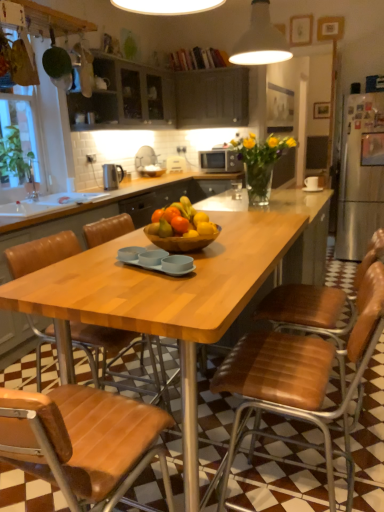
Question: Does matte dark wood cabinets at upper center, the first cabinetry viewed from the right, come behind brown leather chair at lower left, placed as the first chair when sorted from left to right?

Choices:
 (A) no
 (B) yes

Answer: (B)

Question: Can you confirm if matte dark wood cabinets at upper center, the first cabinetry viewed from the right, is smaller than brown leather chair at lower left, placed as the first chair when sorted from left to right?

Choices:
 (A) yes
 (B) no

Answer: (B)

Question: Is matte dark wood cabinets at upper center, marked as the 2th cabinetry in a left-to-right arrangement, oriented away from brown leather chair at lower left, placed as the first chair when sorted from left to right?

Choices:
 (A) yes
 (B) no

Answer: (B)

Question: Does matte dark wood cabinets at upper center, marked as the 2th cabinetry in a left-to-right arrangement, contain brown leather chair at lower left, placed as the first chair when sorted from left to right?

Choices:
 (A) no
 (B) yes

Answer: (A)

Question: From a real-world perspective, is matte dark wood cabinets at upper center, the first cabinetry viewed from the right, physically above brown leather chair at lower left, the second chair from the right?

Choices:
 (A) no
 (B) yes

Answer: (B)

Question: From a real-world perspective, relative to brown leather chair at center, the 1th chair in the right-to-left sequence, is white glossy sink at lower left vertically above or below?

Choices:
 (A) above
 (B) below

Answer: (A)

Question: Is white glossy sink at lower left taller or shorter than brown leather chair at center, the 1th chair in the right-to-left sequence?

Choices:
 (A) tall
 (B) short

Answer: (B)

Question: Based on their positions, is white glossy sink at lower left located to the left or right of brown leather chair at center, marked as the 2th chair in a left-to-right arrangement?

Choices:
 (A) right
 (B) left

Answer: (B)

Question: Considering the positions of point (49, 211) and point (279, 364), is point (49, 211) closer or farther from the camera than point (279, 364)?

Choices:
 (A) closer
 (B) farther

Answer: (B)

Question: Considering the positions of point tap(56, 234) and point tap(342, 399), is point tap(56, 234) closer or farther from the camera than point tap(342, 399)?

Choices:
 (A) farther
 (B) closer

Answer: (A)

Question: From the image's perspective, is brown leather chair at lower left, the second chair from the right, above or below brown leather chair at center, marked as the 2th chair in a left-to-right arrangement?

Choices:
 (A) below
 (B) above

Answer: (B)

Question: Is brown leather chair at lower left, placed as the first chair when sorted from left to right, inside the boundaries of brown leather chair at center, the 1th chair in the right-to-left sequence, or outside?

Choices:
 (A) inside
 (B) outside

Answer: (B)

Question: From a real-world perspective, is brown leather chair at lower left, the second chair from the right, above or below brown leather chair at center, marked as the 2th chair in a left-to-right arrangement?

Choices:
 (A) above
 (B) below

Answer: (A)

Question: From a real-world perspective, is white glossy sink at lower left positioned above or below wooden table at center?

Choices:
 (A) above
 (B) below

Answer: (A)

Question: Does point (61, 193) appear closer or farther from the camera than point (309, 224)?

Choices:
 (A) farther
 (B) closer

Answer: (A)